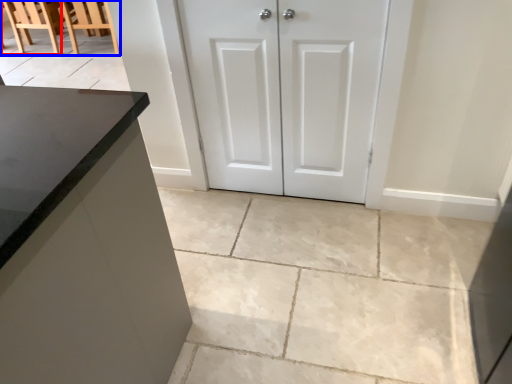
Question: Which point is further to the camera, chair (highlighted by a red box) or chair (highlighted by a blue box)?

Choices:
 (A) chair
 (B) chair

Answer: (A)